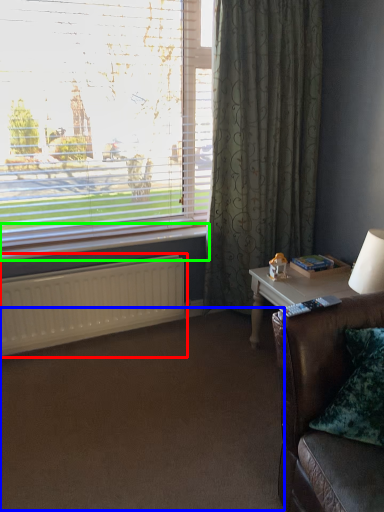
Question: Considering the real-world distances, which object is farthest from radiator (highlighted by a red box)? plain (highlighted by a blue box) or window sill (highlighted by a green box)?

Choices:
 (A) plain
 (B) window sill

Answer: (A)